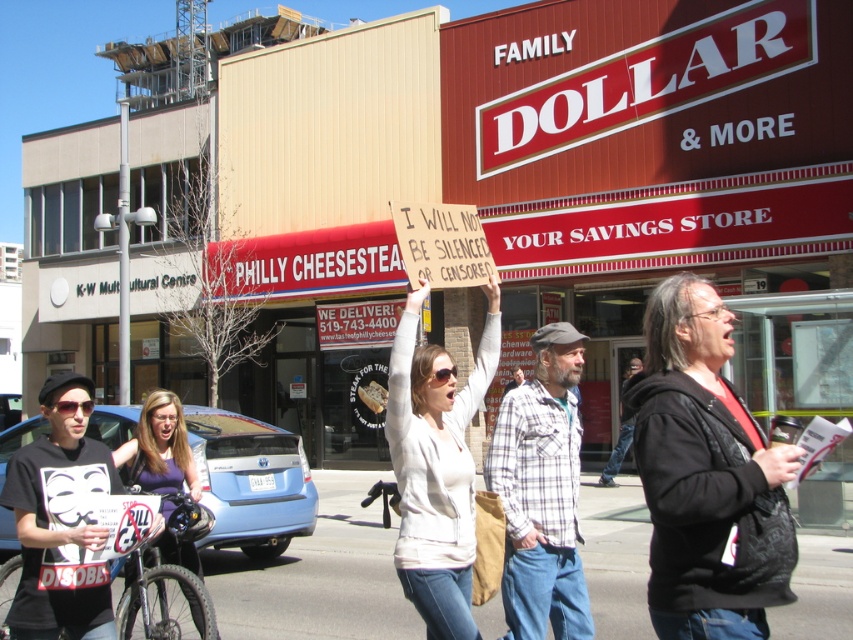
Is point (509, 486) in front of point (151, 444)?

Yes, it is.

Between point (503, 634) and point (154, 467), which one is positioned in front?

Point (154, 467) is in front.

Image resolution: width=853 pixels, height=640 pixels. I want to click on plaid flannel shirt at center, so click(x=541, y=492).

Between point (726, 564) and point (457, 460), which one is positioned in front?

Point (726, 564)

Does black leather jacket at center have a smaller size compared to white cotton shirt at center?

Yes.

Locate an element on the screen. black leather jacket at center is located at coordinates (706, 476).

The width and height of the screenshot is (853, 640). I want to click on black leather jacket at center, so click(x=706, y=476).

Does point (664, 508) come farther from viewer compared to point (506, 444)?

No, (664, 508) is closer to viewer.

Which of these two, black leather jacket at center or plaid flannel shirt at center, stands taller?

plaid flannel shirt at center is taller.

This screenshot has height=640, width=853. What do you see at coordinates (706, 476) in the screenshot? I see `black leather jacket at center` at bounding box center [706, 476].

Identify the location of black leather jacket at center. This screenshot has width=853, height=640. (706, 476).